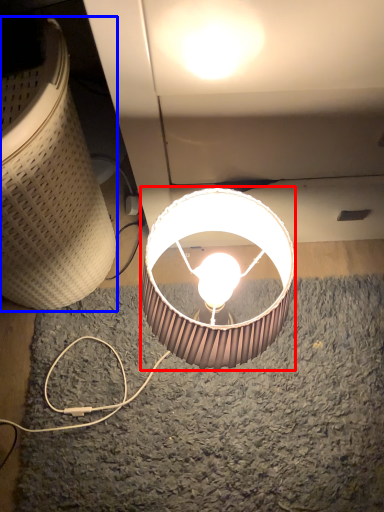
Question: Which object is closer to the camera taking this photo, lamp (highlighted by a red box) or lamp (highlighted by a blue box)?

Choices:
 (A) lamp
 (B) lamp

Answer: (B)